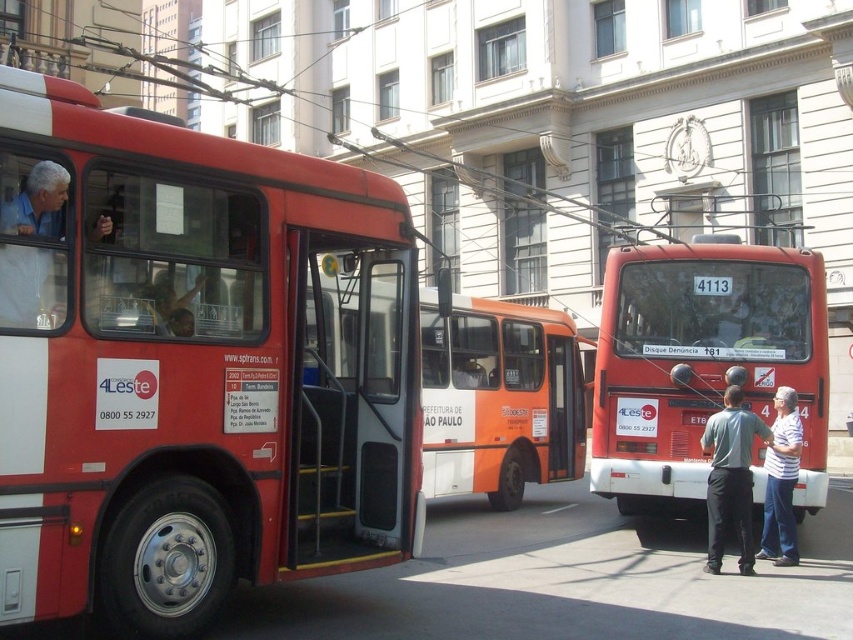
You are a photographer wanting to capture both the matte red bus at center and the orange matte bus at center in a single frame. Which bus should you position closer to the camera to ensure both are fully visible without cropping?

To ensure both the matte red bus at center and the orange matte bus at center are fully visible in a single frame, position the matte red bus at center closer to the camera. Since it is bigger than the orange matte bus at center, placing it nearer will allow you to adjust the framing so both buses fit without cropping.

You are a delivery person who needs to load a package onto the roof of one of the buses. The package requires a minimum height clearance of 3 meters. Given that the matte red bus at left is taller than the orange matte bus at center, which bus would you choose to ensure the package fits?

The matte red bus at left has a greater height compared to the orange matte bus at center, so you should choose the matte red bus at left to ensure the package fits with the required 3 meters height clearance.